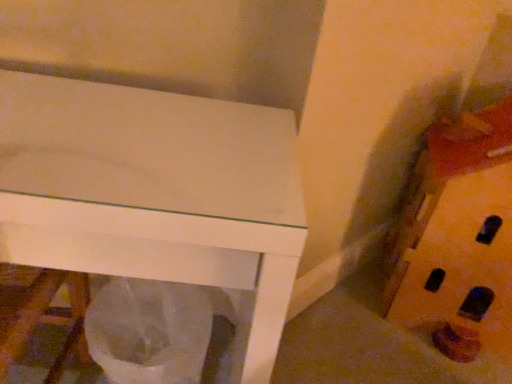
Question: In terms of height, does wooden block at right look taller or shorter compared to white plastic bag at lower center?

Choices:
 (A) short
 (B) tall

Answer: (B)

Question: Is point pyautogui.click(x=433, y=157) positioned closer to the camera than point pyautogui.click(x=162, y=314)?

Choices:
 (A) closer
 (B) farther

Answer: (B)

Question: Considering the relative positions of wooden block at right and white plastic bag at lower center in the image provided, is wooden block at right to the left or to the right of white plastic bag at lower center?

Choices:
 (A) left
 (B) right

Answer: (B)

Question: From the image's perspective, relative to wooden block at right, is white plastic bag at lower center above or below?

Choices:
 (A) above
 (B) below

Answer: (B)

Question: From a real-world perspective, relative to wooden block at right, is white plastic bag at lower center vertically above or below?

Choices:
 (A) below
 (B) above

Answer: (A)

Question: Does point (177, 322) appear closer or farther from the camera than point (445, 259)?

Choices:
 (A) farther
 (B) closer

Answer: (B)

Question: Considering the positions of white plastic bag at lower center and wooden block at right in the image, is white plastic bag at lower center wider or thinner than wooden block at right?

Choices:
 (A) thin
 (B) wide

Answer: (A)